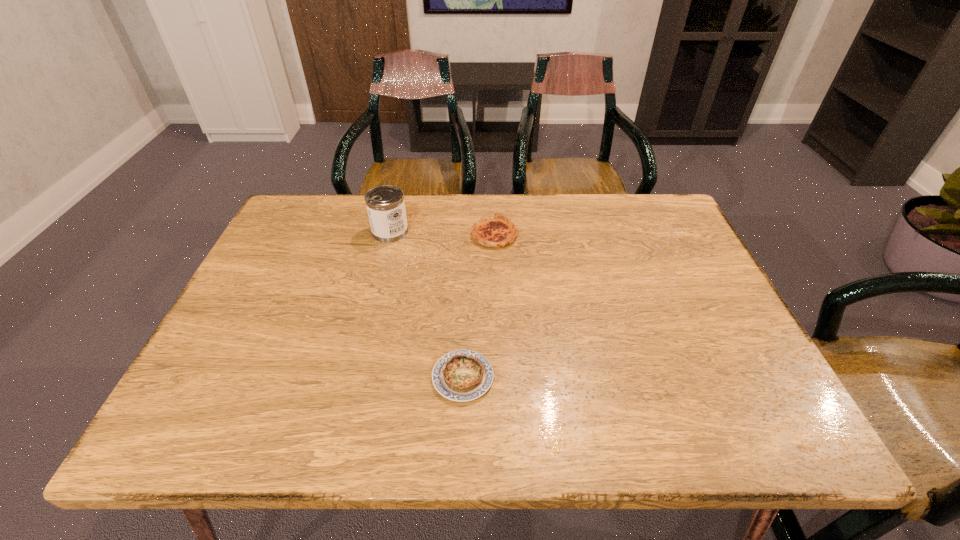
At what (x,y) coordinates should I click in order to perform the action: click on quiche at the far edge. Please return your answer as a coordinate pair (x, y). This screenshot has height=540, width=960. Looking at the image, I should click on (498, 231).

At what (x,y) coordinates should I click in order to perform the action: click on object present at the near edge. Please return your answer as a coordinate pair (x, y). The height and width of the screenshot is (540, 960). Looking at the image, I should click on (462, 375).

The width and height of the screenshot is (960, 540). In the image, there is a desktop. Identify the location of vacant space at the far edge. (589, 195).

Locate an element on the screen. Image resolution: width=960 pixels, height=540 pixels. free space at the near edge of the desktop is located at coordinates (700, 433).

Identify the location of vacant space at the right edge of the desktop. (697, 279).

The image size is (960, 540). I want to click on vacant space at the far left corner of the desktop, so click(297, 209).

Where is `free space at the near right corner of the desktop`? This screenshot has width=960, height=540. free space at the near right corner of the desktop is located at coordinates (716, 442).

You are a GUI agent. You are given a task and a screenshot of the screen. Output one action in this format:
    pyautogui.click(x=<x>, y=<y>)
    Task: Click on the free space between the leftmost object and the taller quiche
    This screenshot has height=540, width=960.
    Given the screenshot: What is the action you would take?
    pyautogui.click(x=443, y=233)

The height and width of the screenshot is (540, 960). What are the coordinates of `free spot between the nearest object and the leftmost object` in the screenshot? It's located at (426, 304).

The width and height of the screenshot is (960, 540). What are the coordinates of `free point between the second shortest object and the can` in the screenshot? It's located at (443, 233).